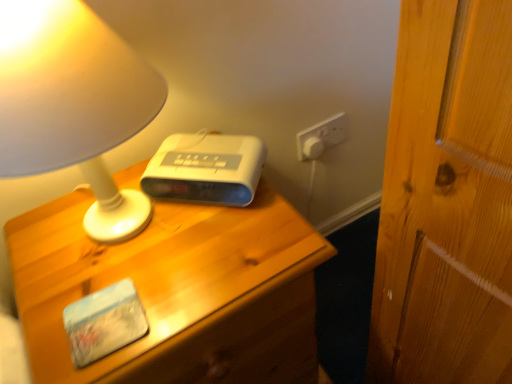
You are a GUI agent. You are given a task and a screenshot of the screen. Output one action in this format:
    pyautogui.click(x=<x>, y=<y>)
    Task: Click on the free space in front of matte white lamp at upper left
    This screenshot has height=384, width=512.
    Given the screenshot: What is the action you would take?
    pyautogui.click(x=130, y=321)